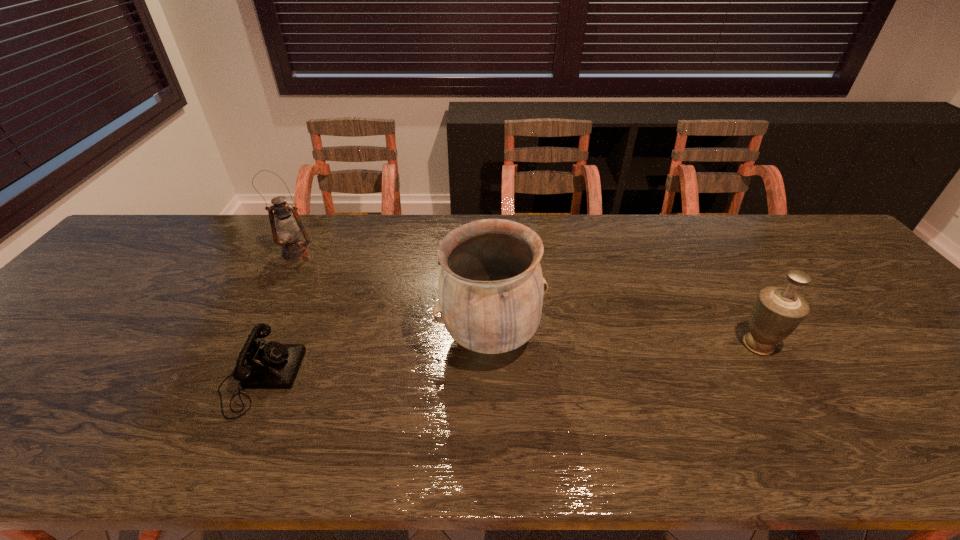
Where is `oil lamp`? This screenshot has width=960, height=540. oil lamp is located at coordinates (288, 228).

This screenshot has height=540, width=960. I want to click on the second object from right to left, so click(x=491, y=286).

Find the location of a particular element. This screenshot has width=960, height=540. the left urn is located at coordinates (491, 286).

Locate an element on the screen. the shorter urn is located at coordinates (777, 312).

Locate an element on the screen. the right urn is located at coordinates (777, 312).

Locate an element on the screen. This screenshot has width=960, height=540. telephone is located at coordinates (273, 365).

In order to click on free space located on the left of the oil lamp in this screenshot , I will do `click(173, 253)`.

I want to click on vacant region located 0.210m on the left of the left urn, so click(x=351, y=337).

Find the location of a particular element. vacant space located on the left of the second shortest object is located at coordinates (592, 345).

What are the coordinates of `vacant space located on the front face of the telephone` in the screenshot? It's located at (323, 377).